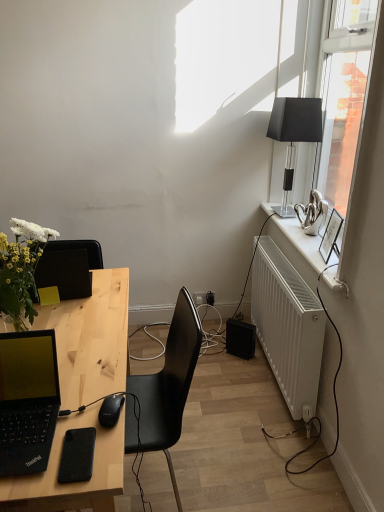
Question: In terms of height, does white glossy radiator at right look taller or shorter compared to black matte laptop at left?

Choices:
 (A) tall
 (B) short

Answer: (B)

Question: Does point (291, 241) appear closer or farther from the camera than point (4, 337)?

Choices:
 (A) closer
 (B) farther

Answer: (B)

Question: Which of these objects is positioned farthest from the black plastic speaker at lower right?

Choices:
 (A) black plastic power outlet at center
 (B) transparent glass window at upper right
 (C) black matte mouse at lower left
 (D) natural wood desk at center
 (E) white matte radiator at right

Answer: (C)

Question: Estimate the real-world distances between objects in this image. Which object is farther from the natural wood desk at center?

Choices:
 (A) black matte mouse at lower left
 (B) black glass lamp at upper right
 (C) black matte phone at lower left
 (D) white glossy radiator at right
 (E) white matte radiator at right

Answer: (B)